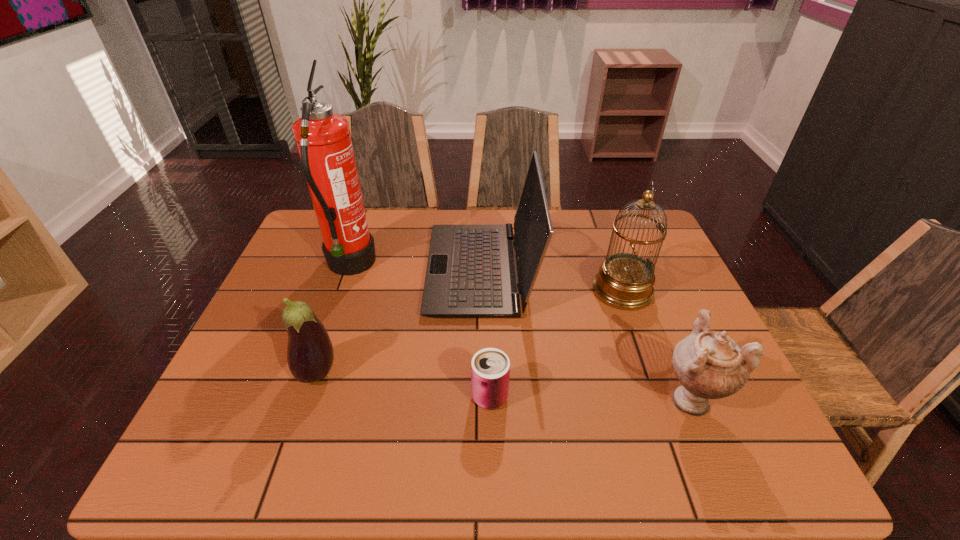
In order to click on fire extinguisher in this screenshot , I will do `click(323, 139)`.

This screenshot has width=960, height=540. I want to click on the second tallest object, so click(x=625, y=281).

Identify the location of laptop computer. The height and width of the screenshot is (540, 960). (471, 273).

Image resolution: width=960 pixels, height=540 pixels. Identify the location of eggplant. (310, 355).

I want to click on urn, so click(709, 365).

Find the location of a particular element. can is located at coordinates 490,368.

Identify the location of vacant region located on the front-facing side of the tallest object. (470, 266).

Locate an element on the screen. Image resolution: width=960 pixels, height=540 pixels. blank space located with an open door on the birdcage is located at coordinates (531, 291).

Locate an element on the screen. The width and height of the screenshot is (960, 540). vacant space located with an open door on the birdcage is located at coordinates 553,291.

The height and width of the screenshot is (540, 960). I want to click on free region located 0.360m with an open door on the birdcage, so click(462, 291).